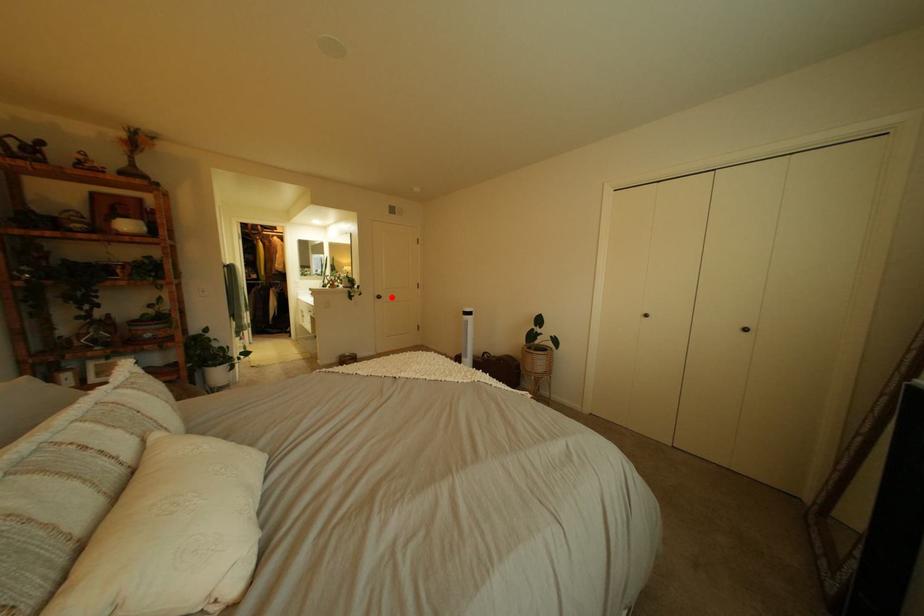
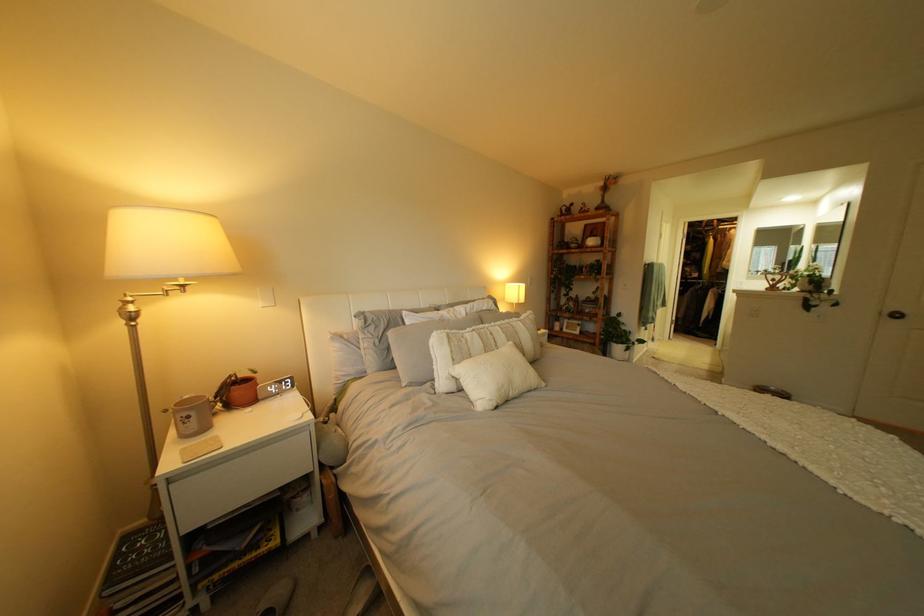
Where in the second image is the point corresponding to the highlighted location from the first image?

(903, 313)